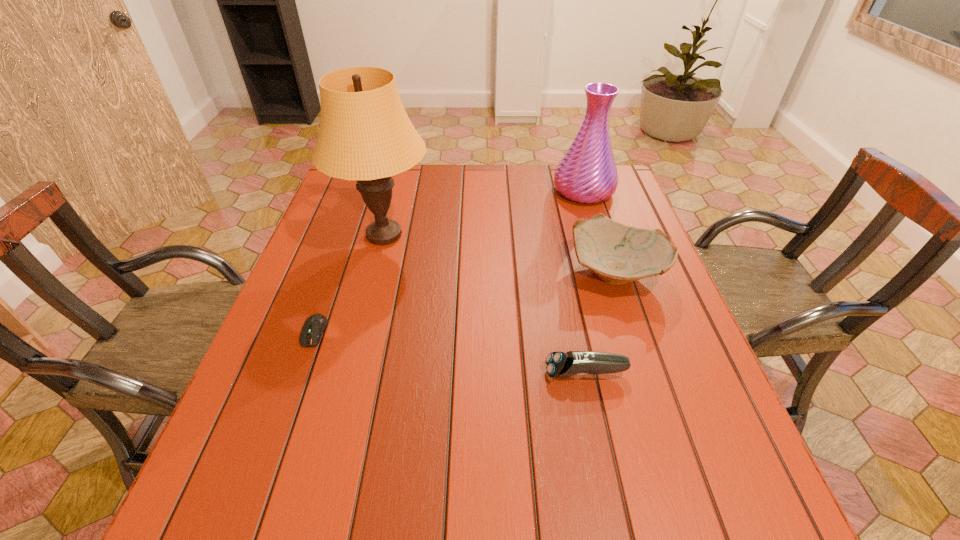
What are the coordinates of `lampshade` in the screenshot? It's located at click(x=365, y=134).

I want to click on vase, so click(587, 173).

At what (x,y) coordinates should I click in order to perform the action: click on the third tallest object. Please return your answer as a coordinate pair (x, y). Looking at the image, I should click on (617, 253).

The height and width of the screenshot is (540, 960). I want to click on the nearest object, so click(x=559, y=364).

I want to click on the second shortest object, so click(559, 364).

Find the location of a particular element. computer equipment is located at coordinates (314, 326).

Find the location of a particular element. This screenshot has height=540, width=960. the shortest object is located at coordinates (314, 326).

What are the coordinates of `free space located 0.200m on the right of the tallest object` in the screenshot? It's located at (506, 235).

Locate an element on the screen. free location located 0.250m on the left of the vase is located at coordinates (472, 191).

Locate an element on the screen. The width and height of the screenshot is (960, 540). vacant space situated on the front of the third shortest object is located at coordinates (650, 371).